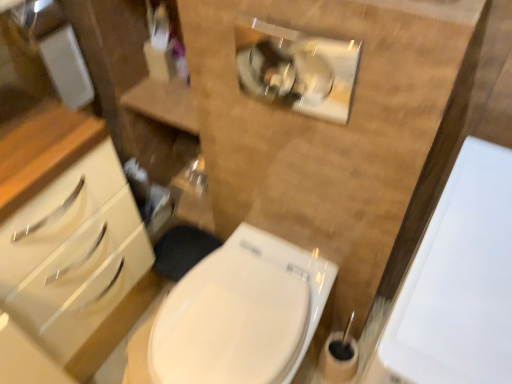
Question: Is white glossy porcelain at right positioned before white glossy toilet at center?

Choices:
 (A) no
 (B) yes

Answer: (B)

Question: Does white glossy porcelain at right touch white glossy toilet at center?

Choices:
 (A) yes
 (B) no

Answer: (B)

Question: Is white glossy porcelain at right shorter than white glossy toilet at center?

Choices:
 (A) no
 (B) yes

Answer: (A)

Question: Is the depth of white glossy porcelain at right greater than that of white glossy toilet at center?

Choices:
 (A) yes
 (B) no

Answer: (B)

Question: Is white glossy porcelain at right thinner than white glossy toilet at center?

Choices:
 (A) yes
 (B) no

Answer: (B)

Question: Would you say white glossy toilet at center is part of white glossy porcelain at right's contents?

Choices:
 (A) no
 (B) yes

Answer: (A)

Question: Does white glossy toilet at center appear on the left side of white glossy porcelain at right?

Choices:
 (A) no
 (B) yes

Answer: (B)

Question: Is white glossy toilet at center taller than white glossy porcelain at right?

Choices:
 (A) no
 (B) yes

Answer: (A)

Question: Is white glossy toilet at center positioned in front of white glossy porcelain at right?

Choices:
 (A) no
 (B) yes

Answer: (A)

Question: Is there a large distance between white glossy toilet at center and white glossy porcelain at right?

Choices:
 (A) no
 (B) yes

Answer: (A)

Question: From the image's perspective, would you say white glossy toilet at center is positioned over white glossy porcelain at right?

Choices:
 (A) no
 (B) yes

Answer: (A)

Question: Would you say white glossy toilet at center is outside white glossy porcelain at right?

Choices:
 (A) no
 (B) yes

Answer: (B)

Question: Is white glossy toilet at center spatially inside white glossy porcelain at right, or outside of it?

Choices:
 (A) inside
 (B) outside

Answer: (B)